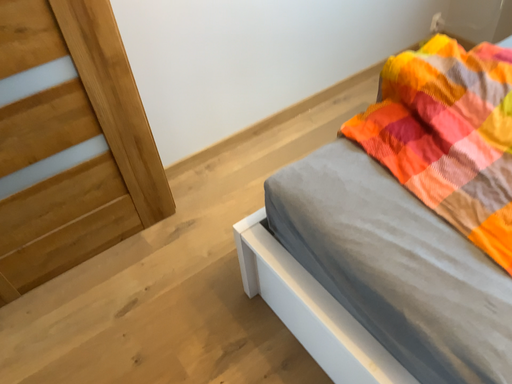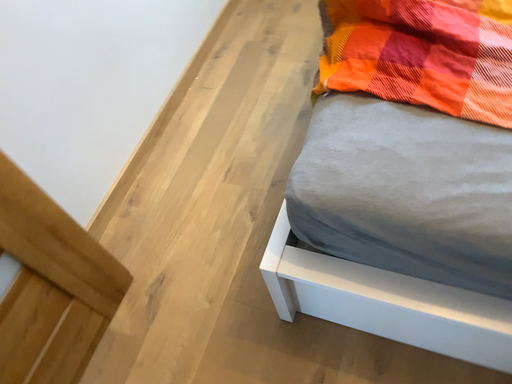
Question: Which way did the camera rotate in the video?

Choices:
 (A) rotated left
 (B) rotated right

Answer: (B)